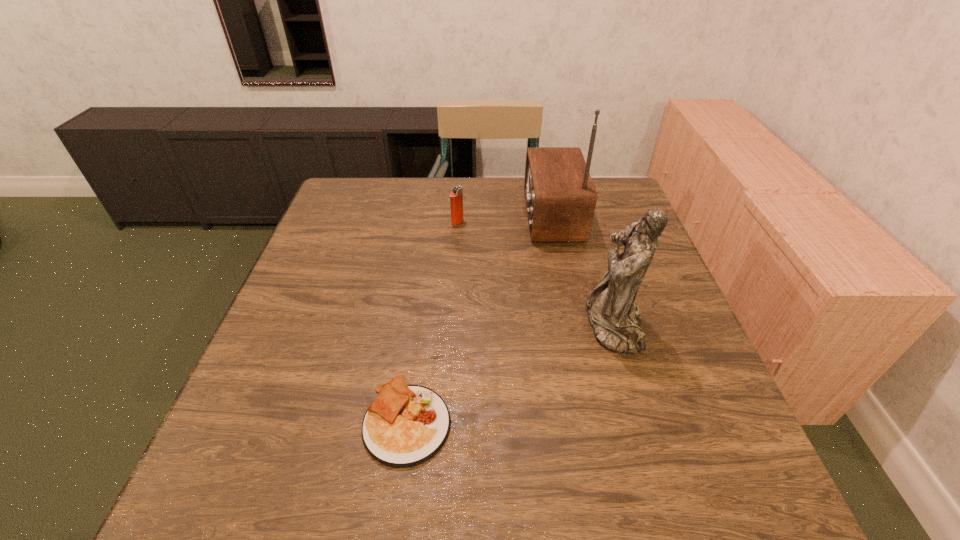
Locate an element on the screen. Image resolution: width=960 pixels, height=540 pixels. free spot between the shortest object and the radio receiver is located at coordinates (479, 318).

Locate an element on the screen. The image size is (960, 540). vacant region between the figurine and the radio receiver is located at coordinates (582, 271).

You are a GUI agent. You are given a task and a screenshot of the screen. Output one action in this format:
    pyautogui.click(x=<x>, y=<y>)
    Task: Click on the free point between the radio receiver and the igniter
    This screenshot has height=540, width=960.
    Given the screenshot: What is the action you would take?
    pyautogui.click(x=504, y=219)

You are a GUI agent. You are given a task and a screenshot of the screen. Output one action in this format:
    pyautogui.click(x=<x>, y=<y>)
    Task: Click on the empty space that is in between the omelet and the second nearest object
    This screenshot has height=540, width=960.
    Given the screenshot: What is the action you would take?
    pyautogui.click(x=511, y=373)

Image resolution: width=960 pixels, height=540 pixels. Identify the location of free area in between the omelet and the figurine. (511, 373).

In order to click on unoccupied area between the radio receiver and the igniter in this screenshot , I will do `click(504, 219)`.

Where is `the third closest object to the omelet`? the third closest object to the omelet is located at coordinates (456, 196).

I want to click on object that can be found as the second closest to the igniter, so click(x=615, y=319).

Find the location of a particular element. free space that satisfies the following two spatial constraints: 1. on the back side of the third tallest object; 2. on the right side of the omelet is located at coordinates (434, 222).